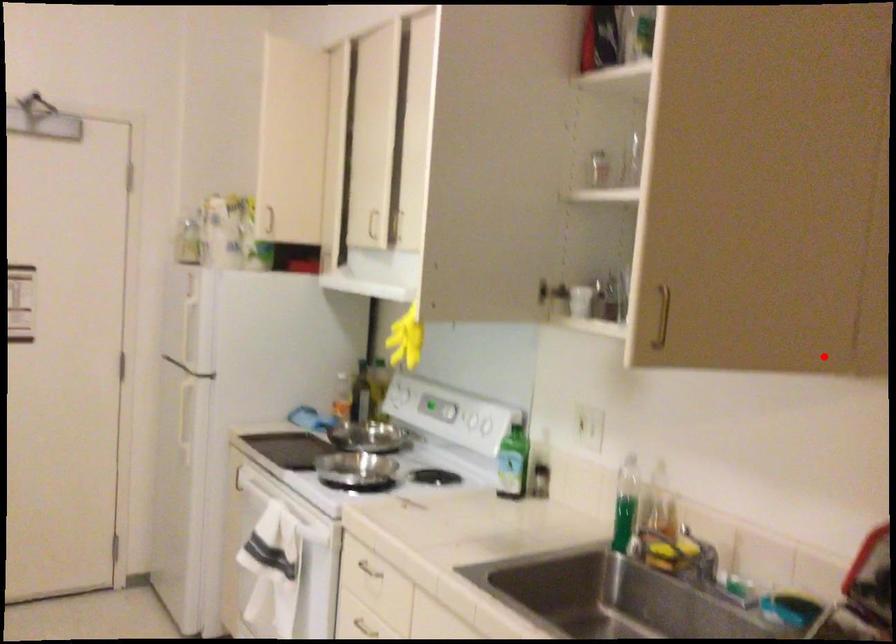
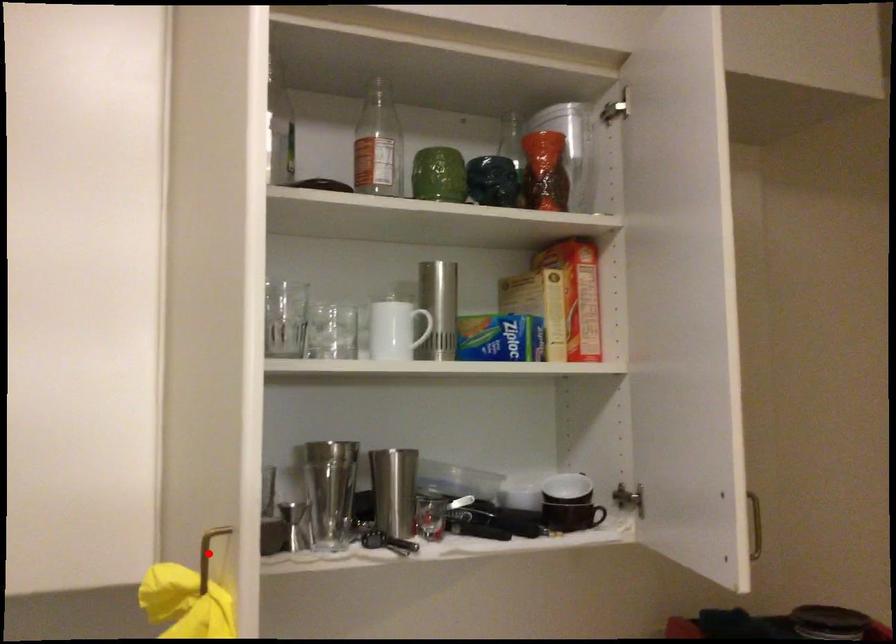
I am providing you with two images of the same scene from different viewpoints. A red point is marked on the first image and another point is marked on the second image. Does the point marked in image1 correspond to the same location as the one in image2?

No